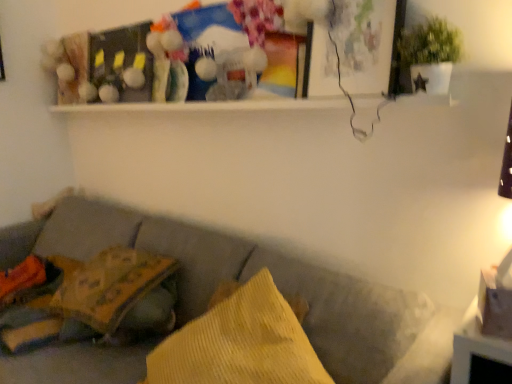
Question: Is point (436, 370) positioned closer to the camera than point (404, 31)?

Choices:
 (A) closer
 (B) farther

Answer: (A)

Question: Would you say textured gray couch at lower left is to the left or to the right of green matte plant at upper right in the picture?

Choices:
 (A) right
 (B) left

Answer: (B)

Question: Based on their relative distances, which object is farther from the yellow corduroy pillow at center, the 1th pillow when ordered from right to left?

Choices:
 (A) green matte plant at upper right
 (B) yellow corduroy pillow at lower left, arranged as the second pillow when viewed from the front
 (C) textured gray couch at lower left

Answer: (A)

Question: Which is farther from the green matte plant at upper right?

Choices:
 (A) yellow corduroy pillow at lower left, which appears as the 2th pillow when viewed from the right
 (B) textured gray couch at lower left
 (C) yellow corduroy pillow at center, the 2th pillow when ordered from left to right

Answer: (A)